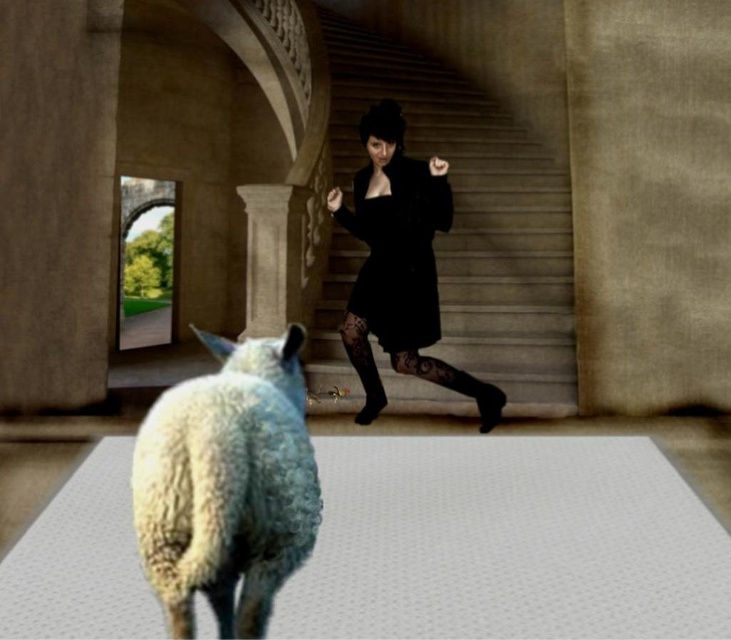
Question: Estimate the real-world distances between objects in this image. Which object is farther from the white textured mat at center?

Choices:
 (A) black textured dress at center
 (B) black lace boot at center
 (C) black matte dress at center

Answer: (C)

Question: Is white woolen sheep at lower left above black textured dress at center?

Choices:
 (A) yes
 (B) no

Answer: (B)

Question: Which of these objects is positioned closest to the smooth stone stairs at center?

Choices:
 (A) white woolen sheep at lower left
 (B) black textured dress at center

Answer: (B)

Question: Which of the following is the closest to the observer?

Choices:
 (A) white woolen sheep at lower left
 (B) smooth stone stairs at center
 (C) white textured mat at center

Answer: (A)

Question: Does black matte dress at center appear over black lace boot at center?

Choices:
 (A) no
 (B) yes

Answer: (B)

Question: Is black textured dress at center wider than black lace boot at center?

Choices:
 (A) no
 (B) yes

Answer: (B)